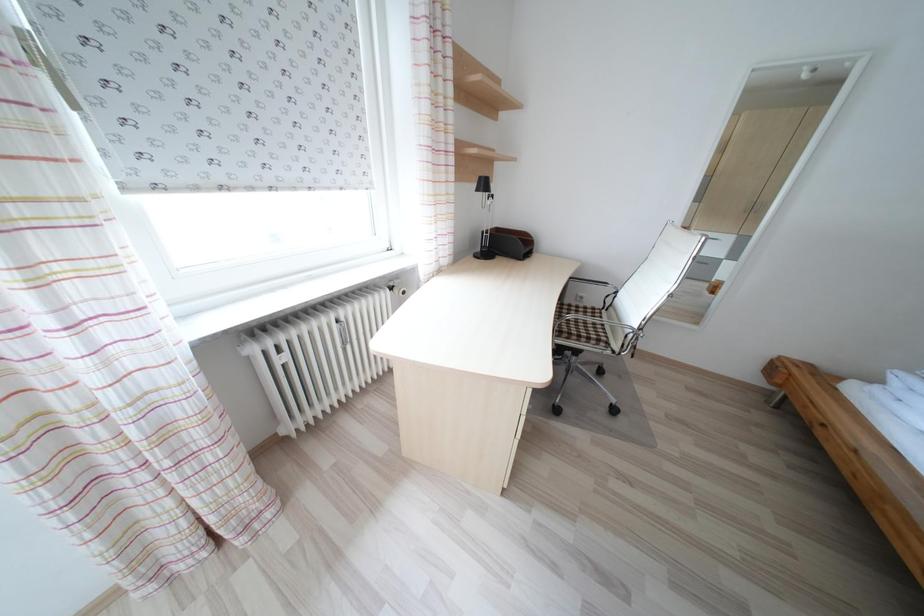
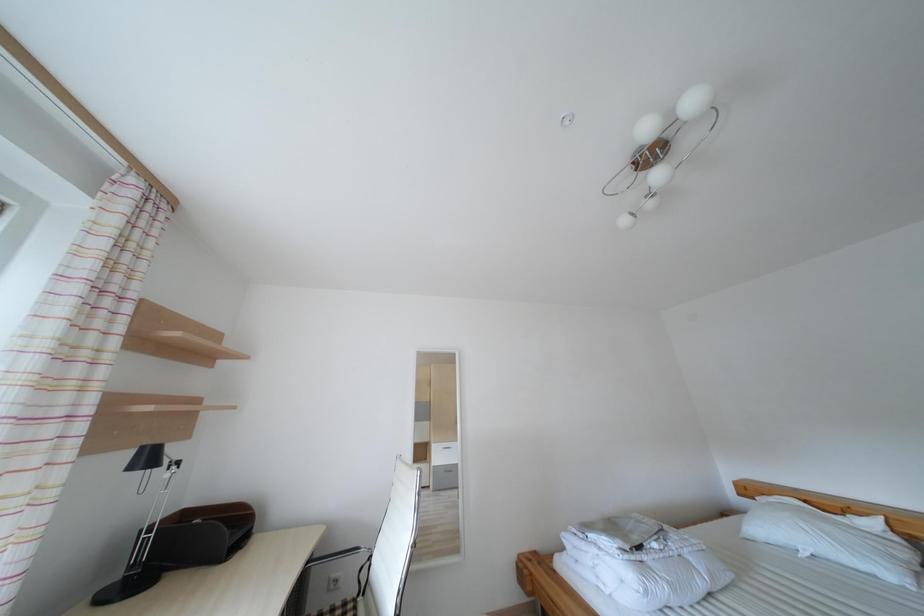
How did the camera likely rotate?

The camera's rotation is toward right-up.